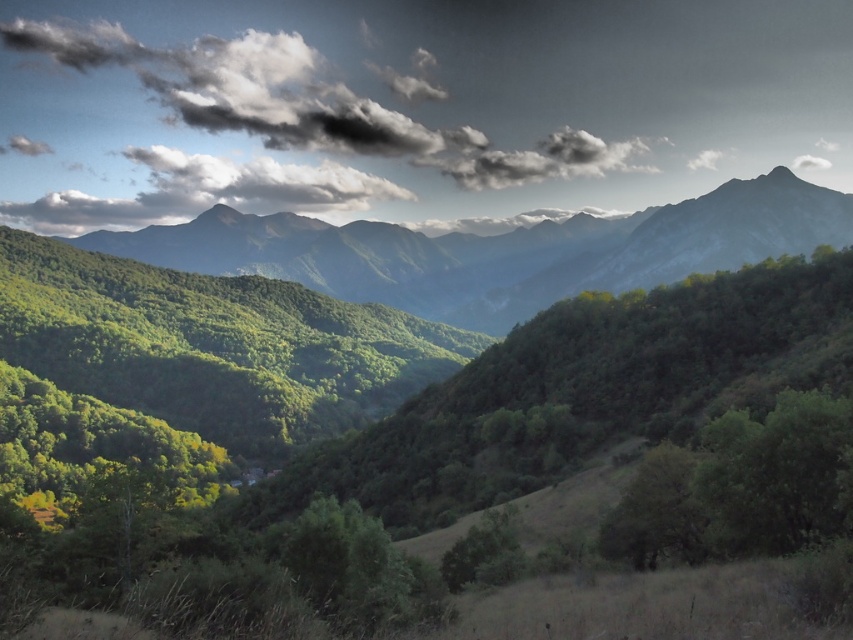
You are standing at the origin point of the coordinate system in this mountainous landscape. You want to reach the green leafy tree at center. Which direction should you move in to get there?

To reach the green leafy tree at center located at coordinate point (352, 566), you should move northeast since the x and y coordinates are both positive and greater than 0.5, indicating a position to the northeast of the origin.

You are standing at the point labeled point (x=374, y=579) and want to walk to the point labeled point (x=508, y=518). Which direction should you head to reach your destination?

You should head away from the camera because point (x=374, y=579) is closer to the camera than point (x=508, y=518).